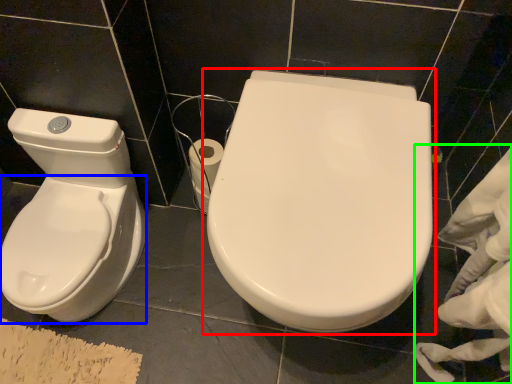
Question: Which object is the closest to the toilet (highlighted by a red box)? Choose among these: bidet (highlighted by a blue box) or material (highlighted by a green box).

Choices:
 (A) bidet
 (B) material

Answer: (B)